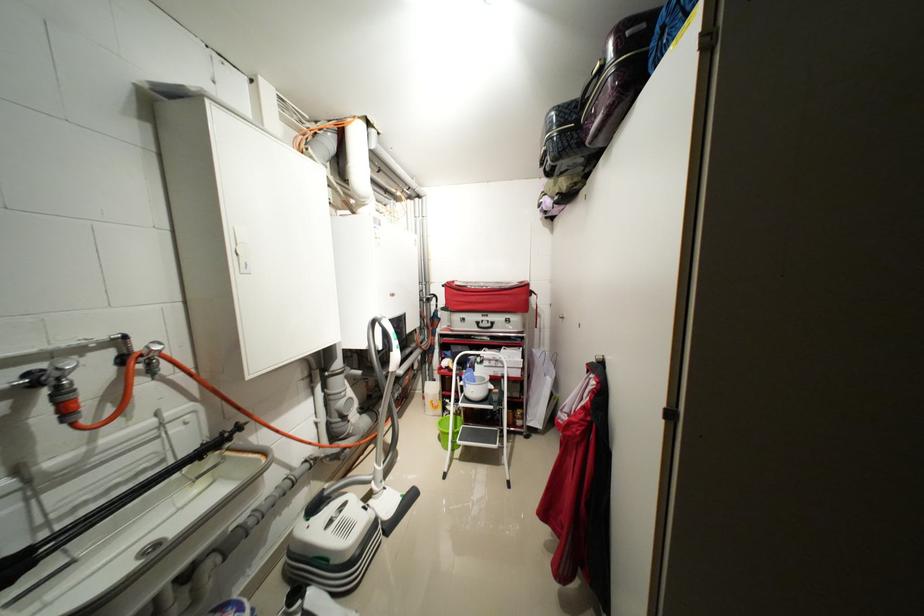
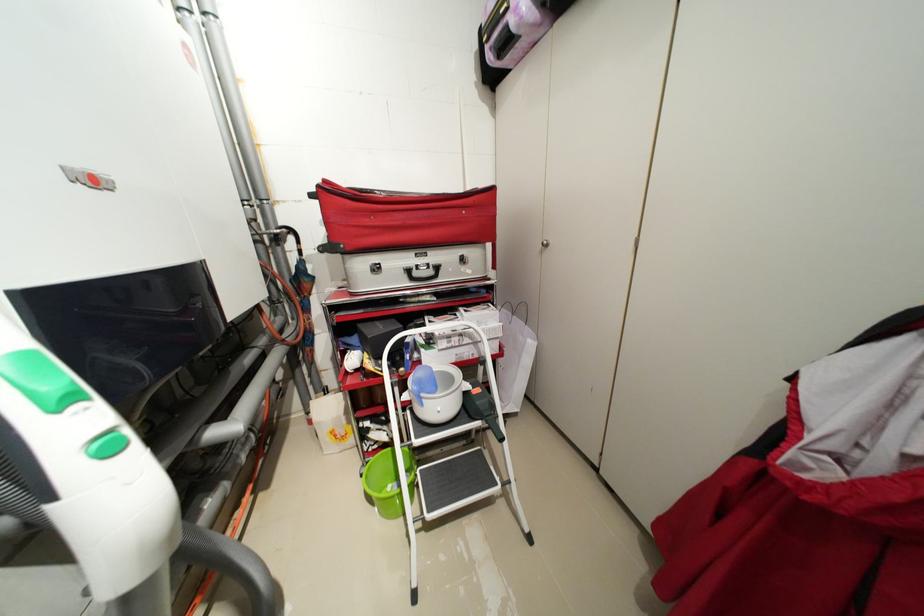
The point at (488,326) is marked in the first image. Where is the corresponding point in the second image?

(422, 275)